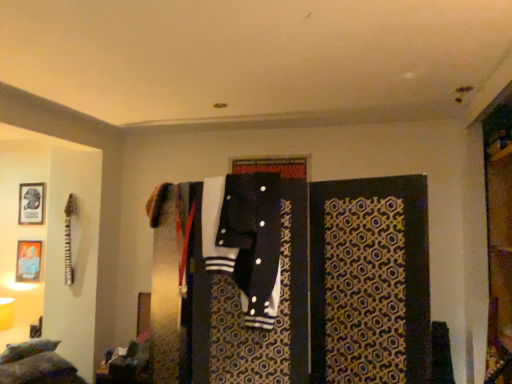
Question: Choose the correct answer: Is black cotton jacket at center inside black fabric closet at center or outside it?

Choices:
 (A) outside
 (B) inside

Answer: (B)

Question: Looking at the image, does black cotton jacket at center seem bigger or smaller compared to black fabric closet at center?

Choices:
 (A) big
 (B) small

Answer: (B)

Question: Which of these objects is positioned closest to the metallic silver picture frame at upper left, which ranks as the first picture frame in top-to-bottom order?

Choices:
 (A) black fabric closet at center
 (B) matte gold picture frame at upper left, the 1th picture frame when ordered from bottom to top
 (C) fluffy multicolored pillows at lower left
 (D) black cotton jacket at center

Answer: (B)

Question: Considering the real-world distances, which object is closest to the matte gold picture frame at upper left, the 1th picture frame when ordered from bottom to top?

Choices:
 (A) black fabric closet at center
 (B) black cotton jacket at center
 (C) fluffy multicolored pillows at lower left
 (D) metallic silver picture frame at upper left, which ranks as the first picture frame in top-to-bottom order

Answer: (D)